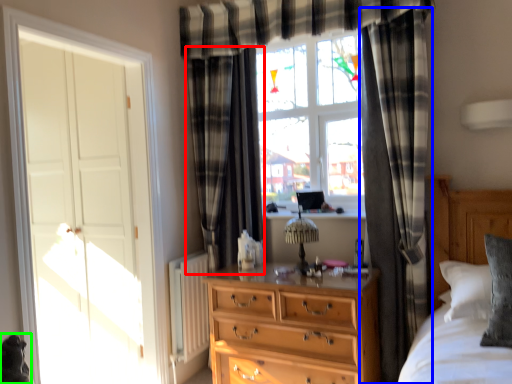
Question: Which is nearer to the curtain (highlighted by a red box)? curtain (highlighted by a blue box) or animal (highlighted by a green box).

Choices:
 (A) curtain
 (B) animal

Answer: (A)